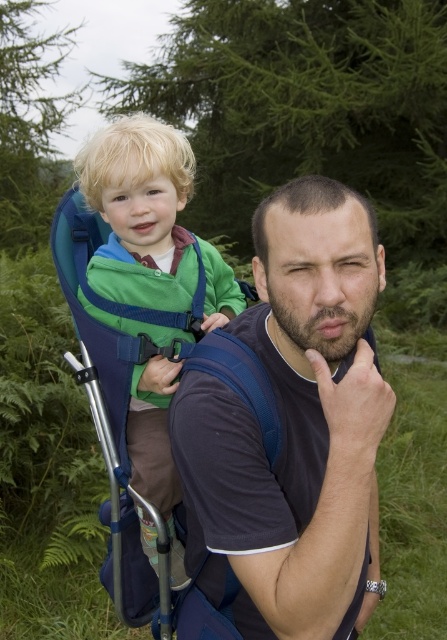
You are an observer standing in front of the scene. Where is the dark blue fabric shirt at center located in terms of coordinates?

The dark blue fabric shirt at center is located at coordinates point (295, 426).

You are an observer looking at the scene. You see the dark blue fabric shirt at center and the green fabric carrier at left. Which object takes up more space in the image?

The green fabric carrier at left takes up more space in the image because it is larger than the dark blue fabric shirt at center.